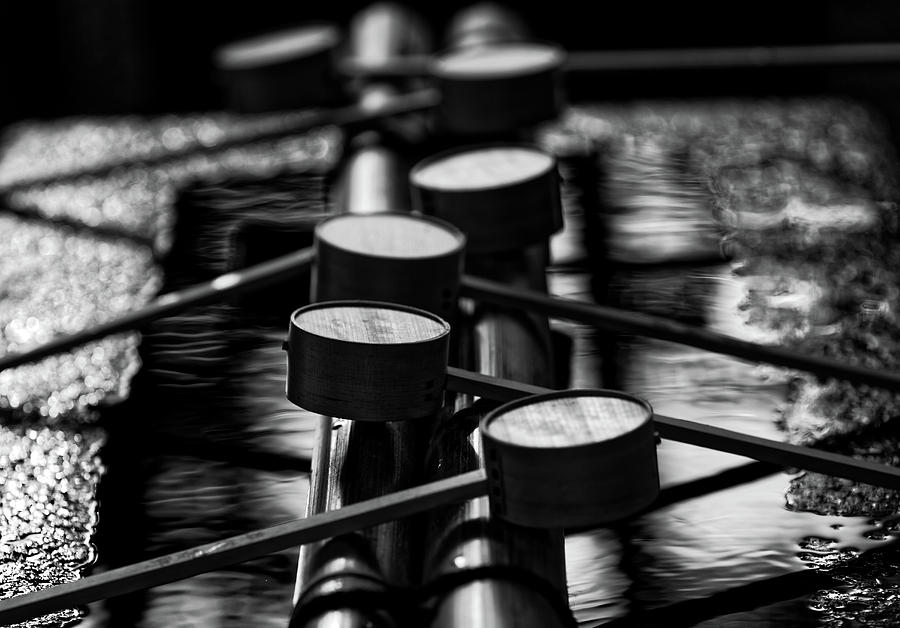
Identify the location of iron. Image resolution: width=900 pixels, height=628 pixels. (238, 555).